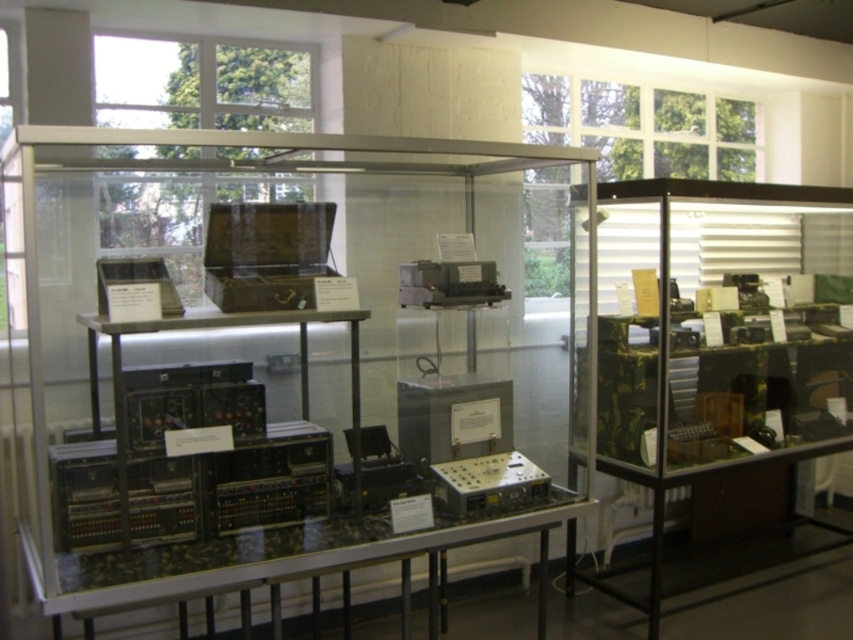
Question: Is clear acrylic glass box at center behind camouflage fabric electronics at right?

Choices:
 (A) no
 (B) yes

Answer: (A)

Question: From the image, what is the correct spatial relationship of clear acrylic glass box at center in relation to metallic silver electronic device at center?

Choices:
 (A) right
 (B) left

Answer: (B)

Question: Among these objects, which one is nearest to the camera?

Choices:
 (A) camouflage fabric electronics at right
 (B) metallic silver electronic device at center
 (C) clear acrylic glass box at center

Answer: (C)

Question: Among these points, which one is nearest to the camera?

Choices:
 (A) (653, 285)
 (B) (166, 484)
 (C) (498, 506)

Answer: (B)

Question: Is clear acrylic glass box at center bigger than camouflage fabric electronics at right?

Choices:
 (A) no
 (B) yes

Answer: (B)

Question: Which of the following is the farthest from the observer?

Choices:
 (A) (463, 467)
 (B) (683, 442)
 (C) (189, 588)

Answer: (B)